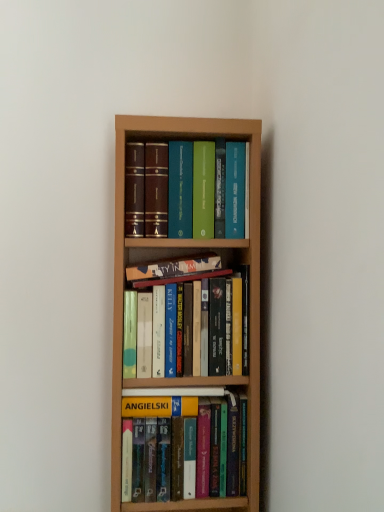
The width and height of the screenshot is (384, 512). Find the location of `free space above hardcover books at center, arranged as the 2th book when ordered from the bottom (from a real-world perspective)`. free space above hardcover books at center, arranged as the 2th book when ordered from the bottom (from a real-world perspective) is located at coordinates (183, 274).